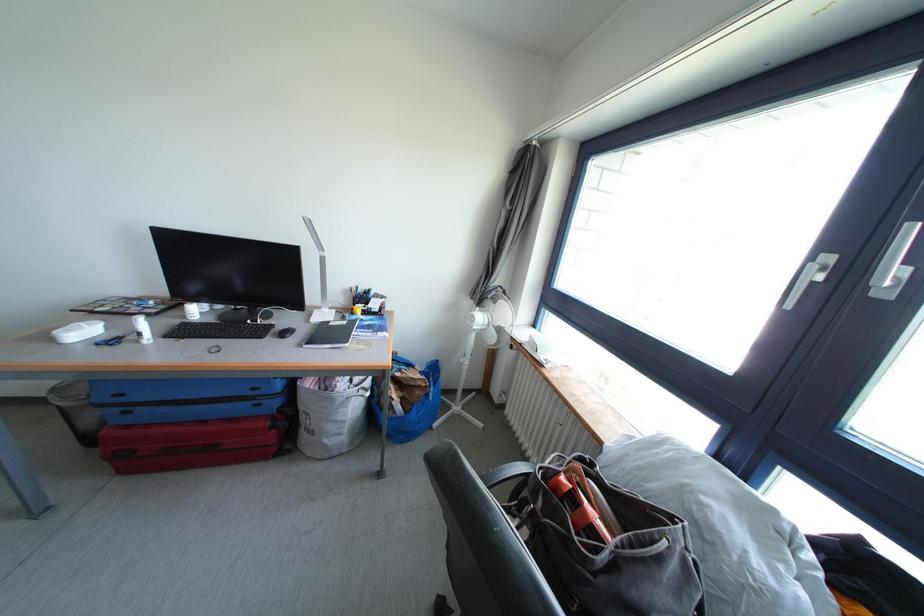
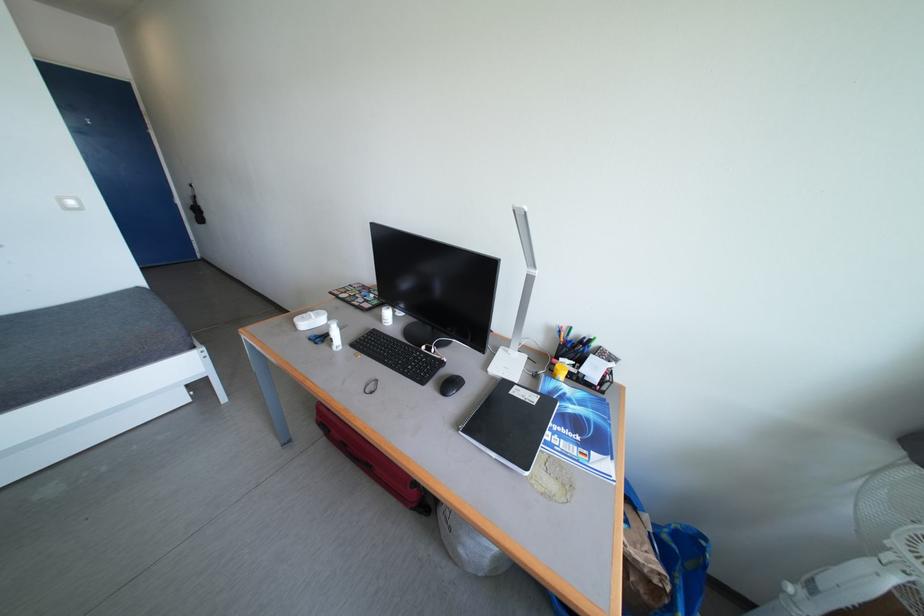
Question: Based on the continuous images, in which direction is the camera rotating? Reply with the corresponding letter.

Choices:
 (A) Left
 (B) Right
 (C) Up
 (D) Down

Answer: (A)